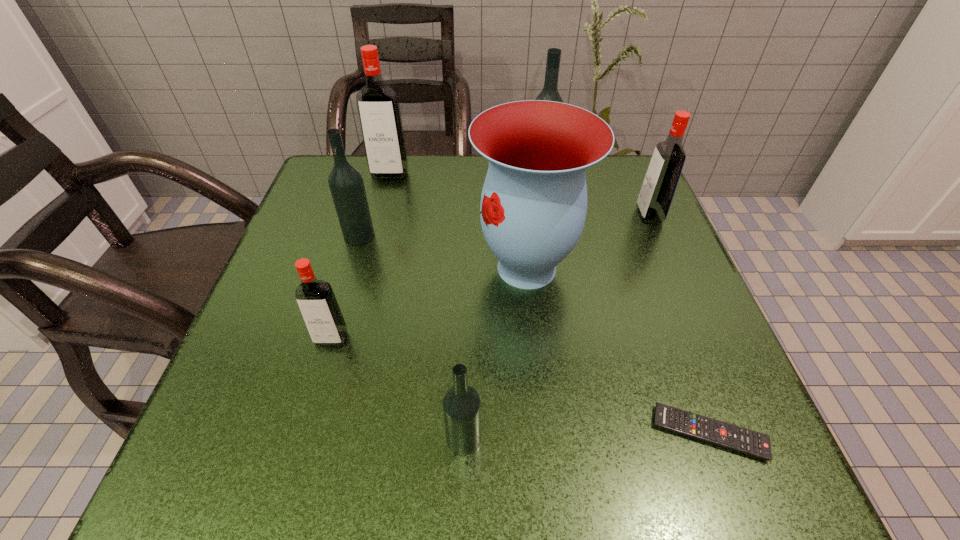
Where is `free region at the far edge of the desktop`? The image size is (960, 540). free region at the far edge of the desktop is located at coordinates (422, 207).

This screenshot has height=540, width=960. I want to click on blank area at the left edge, so click(x=287, y=327).

In order to click on vacant space at the right edge in this screenshot , I will do `click(674, 246)`.

This screenshot has width=960, height=540. In order to click on free region at the far left corner in this screenshot , I will do `click(351, 163)`.

You are a GUI agent. You are given a task and a screenshot of the screen. Output one action in this format:
    pyautogui.click(x=<x>, y=<y>)
    Task: Click on the free space between the shortest object and the rightmost red vodka
    
    Given the screenshot: What is the action you would take?
    pyautogui.click(x=679, y=324)

At what (x,y) coordinates should I click in order to perform the action: click on unoccupied position between the rightmost black vodka and the shortest object. Please return your answer as a coordinate pair (x, y). Looking at the image, I should click on (625, 305).

This screenshot has height=540, width=960. I want to click on vacant area that lies between the second nearest black vodka and the farthest red vodka, so click(374, 205).

Locate an element on the screen. This screenshot has height=540, width=960. free space between the remote control and the biggest red vodka is located at coordinates (549, 303).

This screenshot has height=540, width=960. Identify the location of free space that is in between the rightmost black vodka and the rightmost red vodka. (595, 197).

This screenshot has width=960, height=540. I want to click on unoccupied position between the second smallest red vodka and the vase, so click(588, 242).